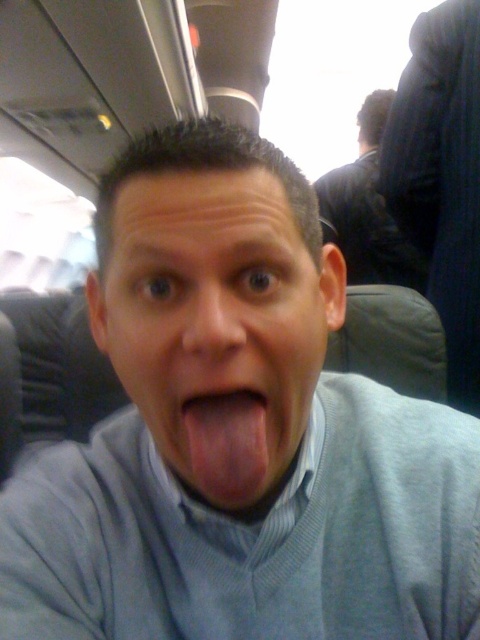
You are an airplane stewardess checking passengers. You notice the gray matte face at center and the smooth skin nose at center. Which one has a greater width?

The gray matte face at center has a greater width than the smooth skin nose at center.